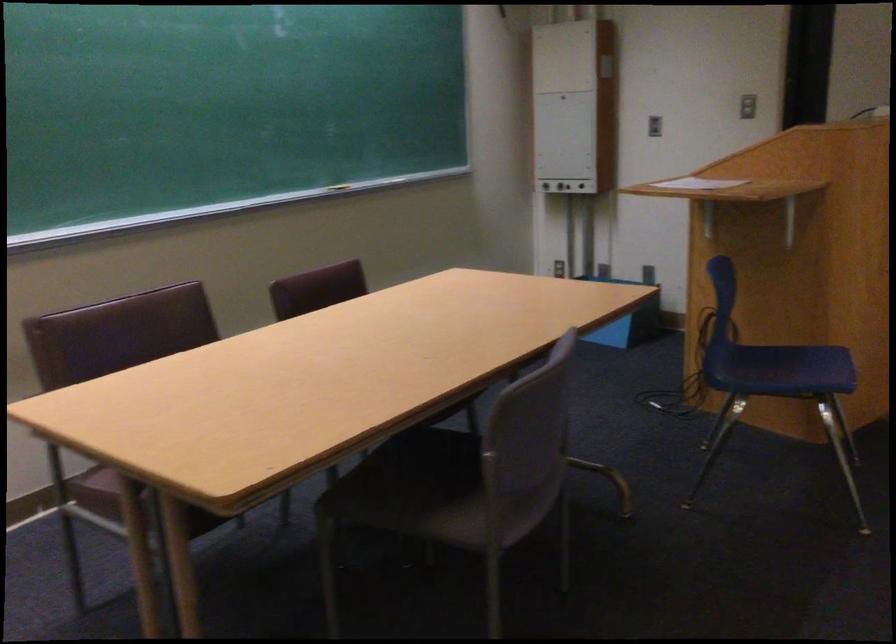
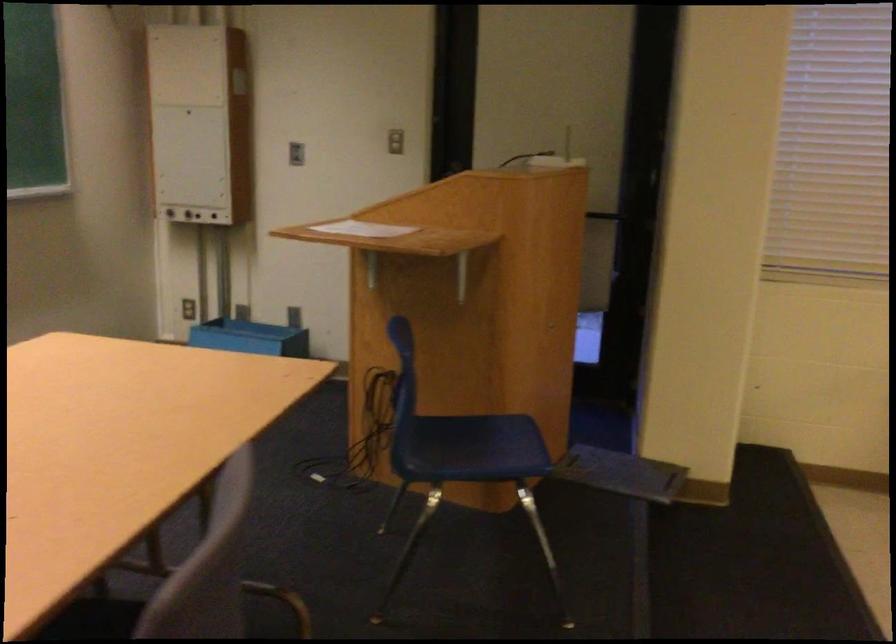
Question: How did the camera likely rotate?

Choices:
 (A) Left
 (B) Right
 (C) Up
 (D) Down

Answer: (B)